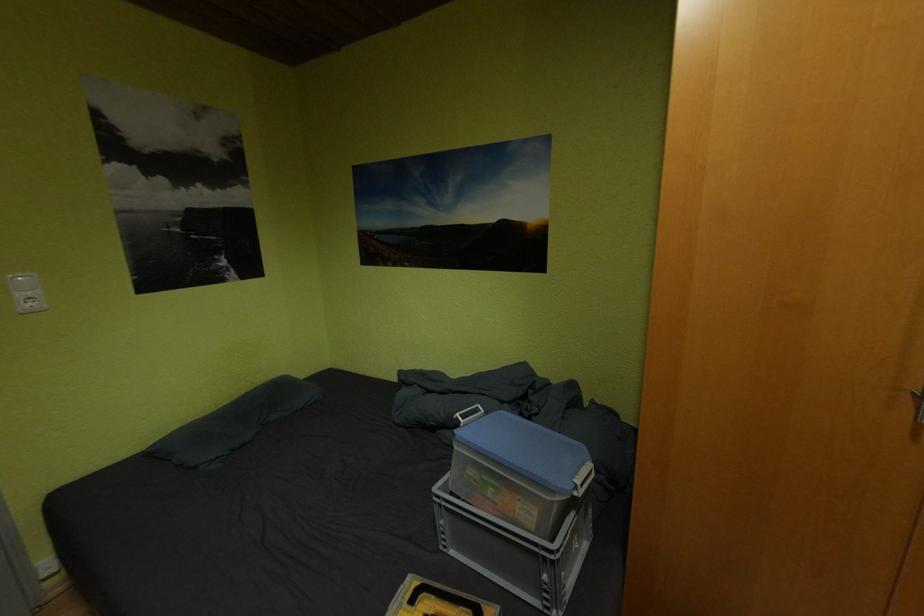
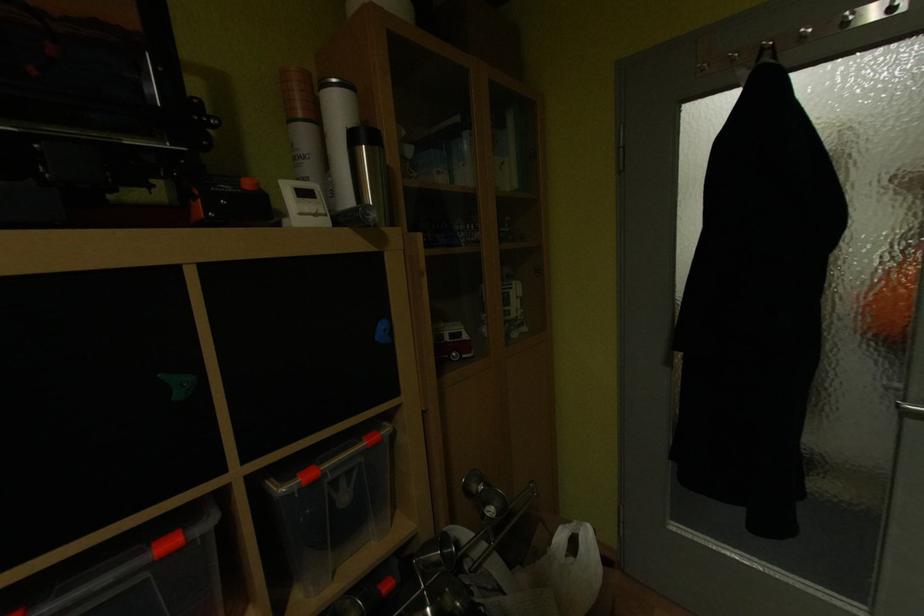
Question: The images are taken continuously from a first-person perspective. In which direction is your viewpoint rotating?

Choices:
 (A) Left
 (B) Right
 (C) Up
 (D) Down

Answer: (A)